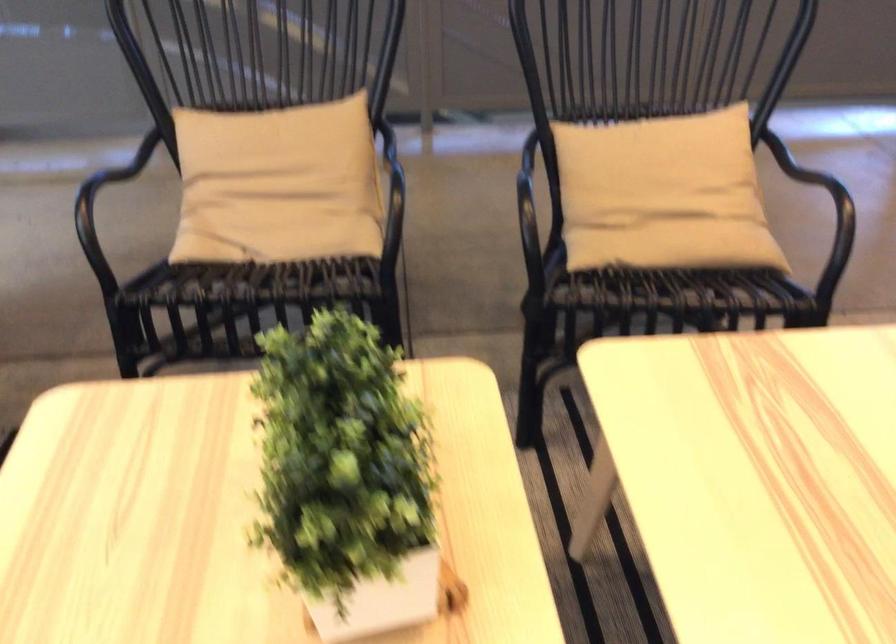
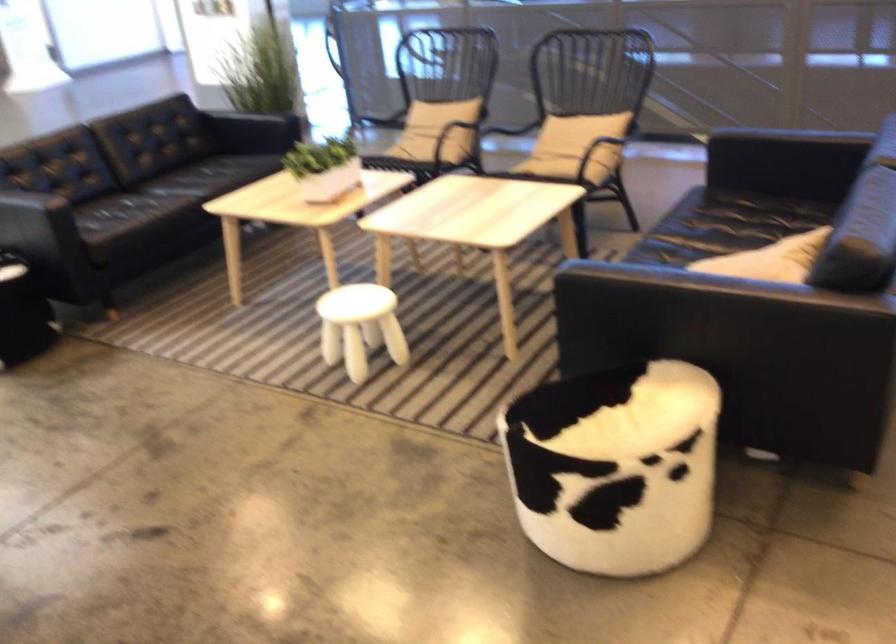
Where in the second image is the point corresponding to pixel 750 214 from the first image?

(574, 147)